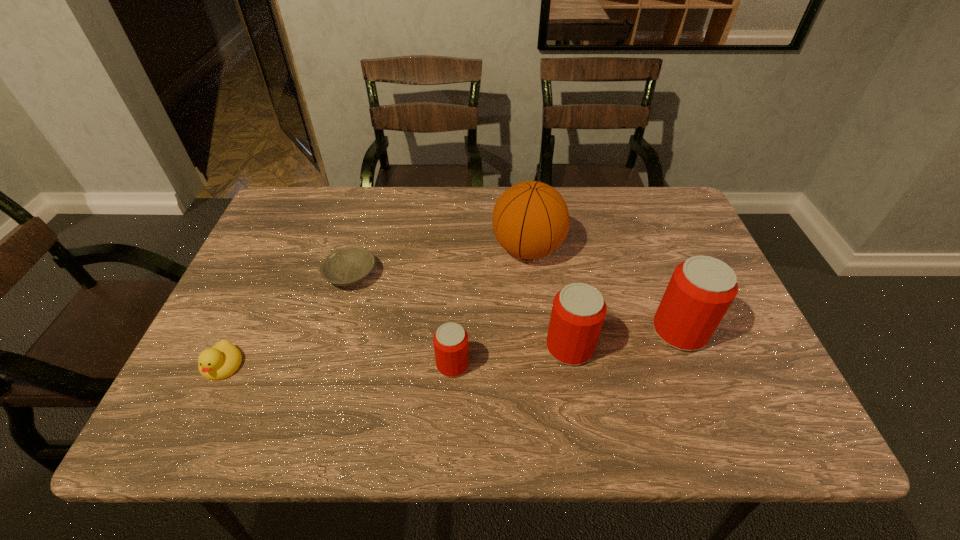
Find the location of `free space between the shortest object and the shortest beer can`. free space between the shortest object and the shortest beer can is located at coordinates (402, 320).

Identify the location of vacant area that lies between the shortest object and the rightmost object. (516, 303).

What are the coordinates of `vacant region between the basketball and the leftmost object` in the screenshot? It's located at (375, 307).

Locate an element on the screen. Image resolution: width=960 pixels, height=540 pixels. unoccupied area between the fourth shortest object and the third shortest object is located at coordinates (512, 356).

What are the coordinates of `vacant area between the rightmost object and the second tallest beer can` in the screenshot? It's located at (625, 339).

Locate an element on the screen. object that is the fifth nearest to the shortest beer can is located at coordinates (701, 289).

The image size is (960, 540). I want to click on the fifth closest object relative to the third shortest object, so click(701, 289).

I want to click on the second closest beer can to the rightmost beer can, so click(450, 340).

Find the location of a particular element. This screenshot has height=540, width=960. beer can that stands as the third closest to the basketball is located at coordinates (450, 340).

At what (x,y) coordinates should I click in order to perform the action: click on vacant space that satisfies the following two spatial constraints: 1. on the front side of the second beer can from left to right; 2. on the left side of the bowl. Please return your answer as a coordinate pair (x, y). The width and height of the screenshot is (960, 540). Looking at the image, I should click on (330, 347).